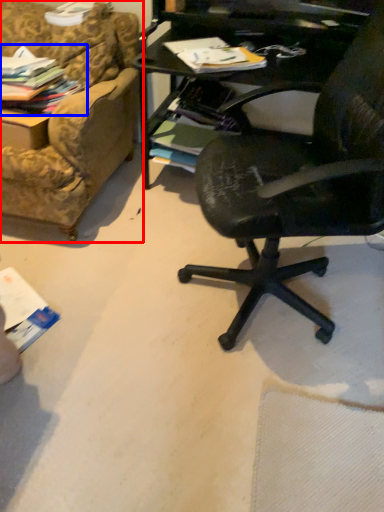
Question: Among these objects, which one is nearest to the camera, studio couch (highlighted by a red box) or magazine (highlighted by a blue box)?

Choices:
 (A) studio couch
 (B) magazine

Answer: (B)